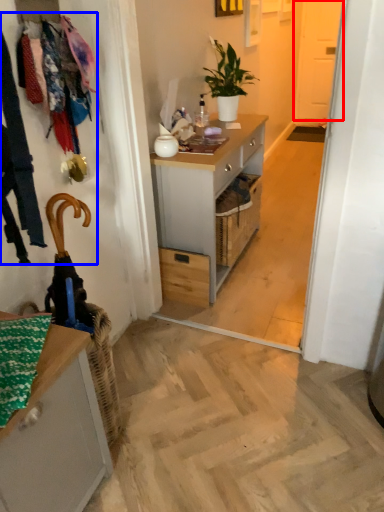
Question: Which object appears closest to the camera in this image, screen door (highlighted by a red box) or laundry (highlighted by a blue box)?

Choices:
 (A) screen door
 (B) laundry

Answer: (B)